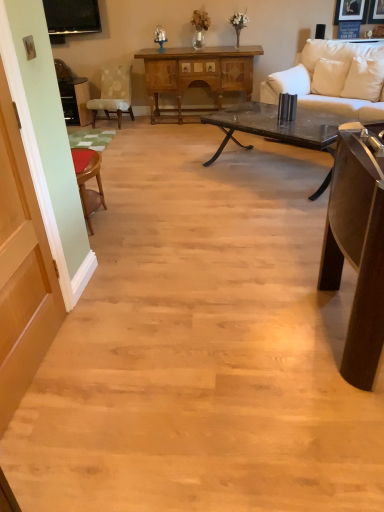
Find the location of a particular element. This screenshot has width=384, height=512. blank space situated above black glass coffee table at center (from a real-world perspective) is located at coordinates (274, 119).